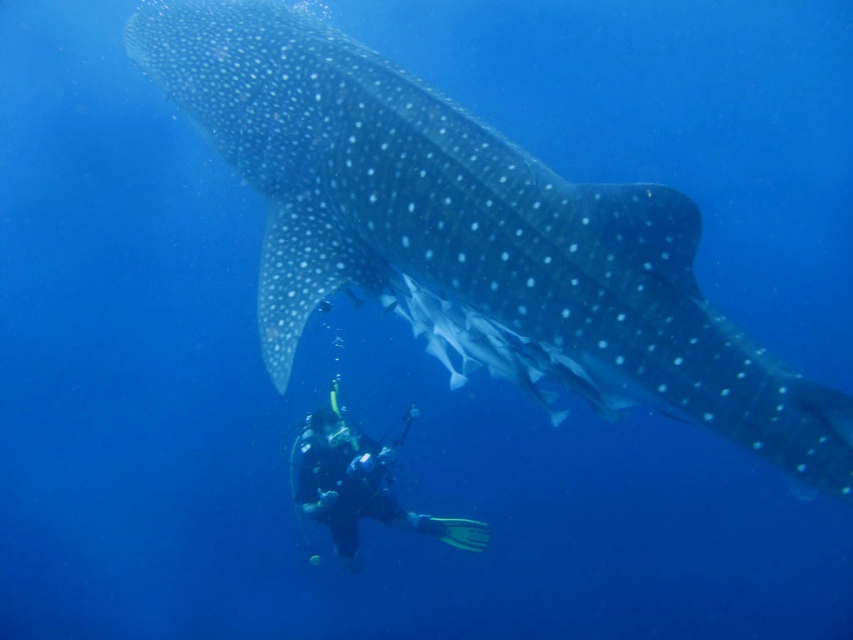
Is point (399, 156) positioned in front of point (323, 442)?

That is True.

Is smooth gray shark at center wider than black rubber wetsuit at lower center?

Indeed, smooth gray shark at center has a greater width compared to black rubber wetsuit at lower center.

Find the location of a particular element. The image size is (853, 640). smooth gray shark at center is located at coordinates (467, 225).